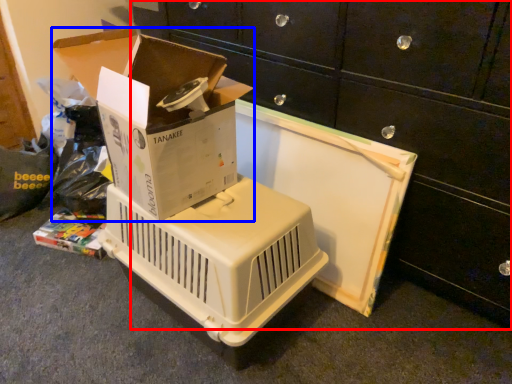
Question: Which point is closer to the camera, furniture (highlighted by a red box) or box (highlighted by a blue box)?

Choices:
 (A) furniture
 (B) box

Answer: (A)